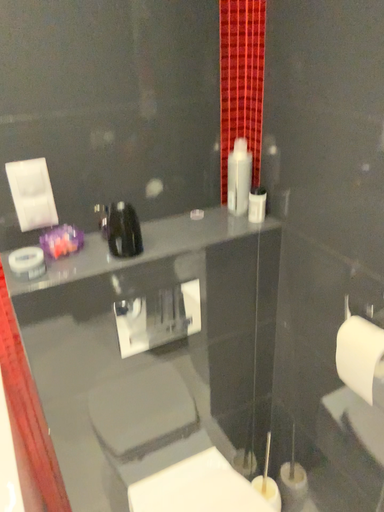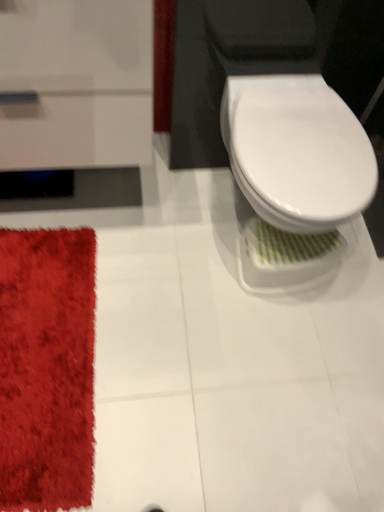
Question: How did the camera likely rotate when shooting the video?

Choices:
 (A) rotated downward
 (B) rotated upward

Answer: (A)